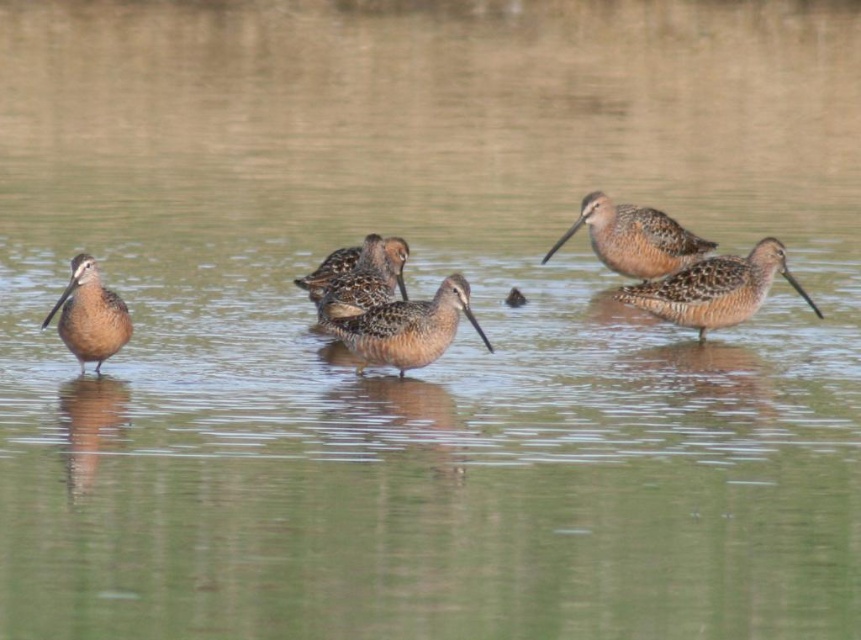
Is brown speckled bird at left taller than brown speckled feathers at center?

Correct, brown speckled bird at left is much taller as brown speckled feathers at center.

At what (x,y) coordinates should I click in order to perform the action: click on brown speckled bird at left. Please return your answer as a coordinate pair (x, y). This screenshot has height=640, width=861. Looking at the image, I should click on (90, 316).

Does brown speckled feathers at right have a smaller size compared to brown matte bird at center?

No, brown speckled feathers at right is not smaller than brown matte bird at center.

In order to click on brown speckled feathers at right in this screenshot , I will do 715,289.

Which of these two, brown matte bird at center or brown feathered bird at upper right, stands shorter?

brown matte bird at center

Is point (391, 353) in front of point (676, 268)?

Yes, point (391, 353) is in front of point (676, 268).

At what (x,y) coordinates should I click in order to perform the action: click on brown matte bird at center. Please return your answer as a coordinate pair (x, y). Looking at the image, I should click on (406, 328).